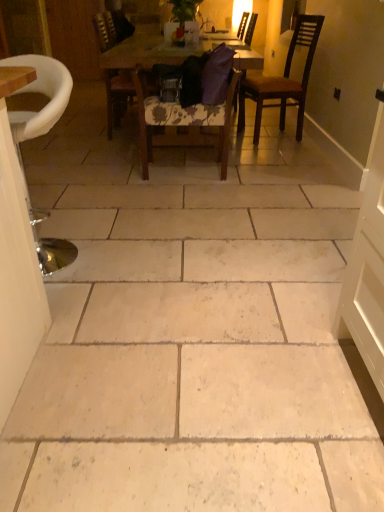
You are a GUI agent. You are given a task and a screenshot of the screen. Output one action in this format:
    pyautogui.click(x=<x>, y=<y>)
    Task: Click on the vacant space in front of floral fabric chair at center, which is counted as the fourth chair, starting from the back
    The height and width of the screenshot is (512, 384).
    Given the screenshot: What is the action you would take?
    pyautogui.click(x=182, y=196)